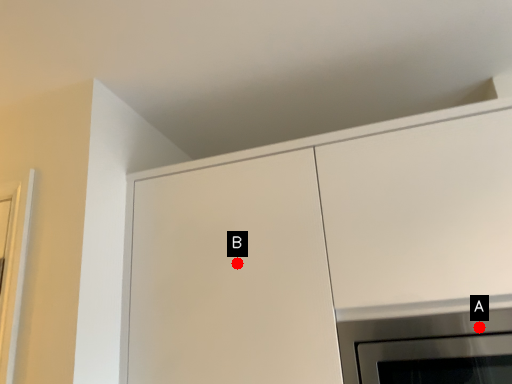
Question: Two points are circled on the image, labeled by A and B beside each circle. Which of the following is the closest to the observer?

Choices:
 (A) A is closer
 (B) B is closer

Answer: (A)